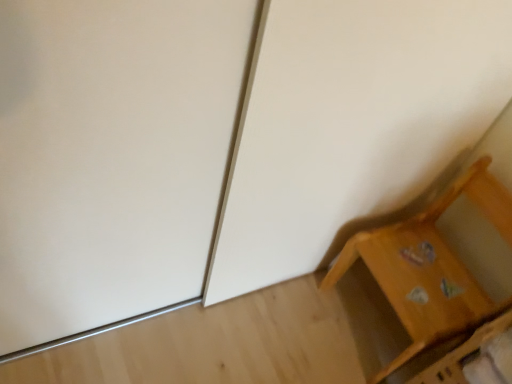
The width and height of the screenshot is (512, 384). Find the location of `vacant space to the left of wooden chair at lower right`. vacant space to the left of wooden chair at lower right is located at coordinates (287, 319).